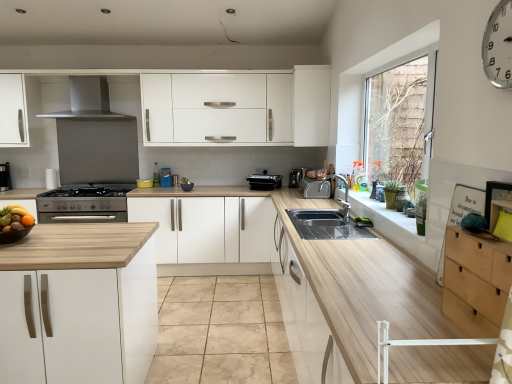
Question: Which direction should I rotate to look at white matte cabinet at center, which is counted as the third cabinetry, starting from the top, — up or down?

Choices:
 (A) up
 (B) down

Answer: (B)

Question: Is white matte cabinet at upper center, acting as the third cabinetry starting from the bottom, surrounded by black matte bowl at left?

Choices:
 (A) yes
 (B) no

Answer: (B)

Question: Does black matte bowl at left appear on the left side of white matte cabinet at upper center, which ranks as the first cabinetry in top-to-bottom order?

Choices:
 (A) no
 (B) yes

Answer: (B)

Question: From the image's perspective, does black matte bowl at left appear lower than white matte cabinet at upper center, which ranks as the first cabinetry in top-to-bottom order?

Choices:
 (A) no
 (B) yes

Answer: (B)

Question: Could you tell me if black matte bowl at left is facing white matte cabinet at upper center, which ranks as the second cabinetry in left-to-right order?

Choices:
 (A) yes
 (B) no

Answer: (B)

Question: Does black matte bowl at left have a greater width compared to white matte cabinet at upper center, acting as the third cabinetry starting from the bottom?

Choices:
 (A) no
 (B) yes

Answer: (A)

Question: Is black matte bowl at left shorter than white matte cabinet at upper center, which appears as the 2th cabinetry when viewed from the back?

Choices:
 (A) no
 (B) yes

Answer: (B)

Question: Would you consider matte black coffee machine at left to be distant from black matte bowl at left?

Choices:
 (A) yes
 (B) no

Answer: (A)

Question: Can we say matte black coffee machine at left lies outside black matte bowl at left?

Choices:
 (A) no
 (B) yes

Answer: (B)

Question: Can you confirm if matte black coffee machine at left is thinner than black matte bowl at left?

Choices:
 (A) no
 (B) yes

Answer: (B)

Question: Is matte black coffee machine at left taller than black matte bowl at left?

Choices:
 (A) yes
 (B) no

Answer: (A)

Question: Is the depth of matte black coffee machine at left less than that of black matte bowl at left?

Choices:
 (A) yes
 (B) no

Answer: (B)

Question: From a real-world perspective, is matte black coffee machine at left below black matte bowl at left?

Choices:
 (A) yes
 (B) no

Answer: (B)

Question: Can you confirm if white matte cabinet at upper center, which ranks as the first cabinetry in top-to-bottom order, is shorter than satin silver stove at lower left, which is the first appliance in left-to-right order?

Choices:
 (A) yes
 (B) no

Answer: (B)